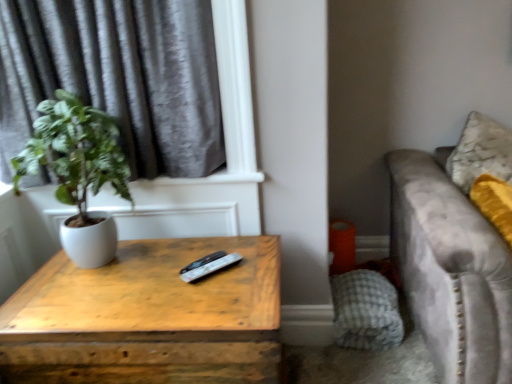
The width and height of the screenshot is (512, 384). Identify the location of empty space that is to the right of white matte pot at left. (177, 264).